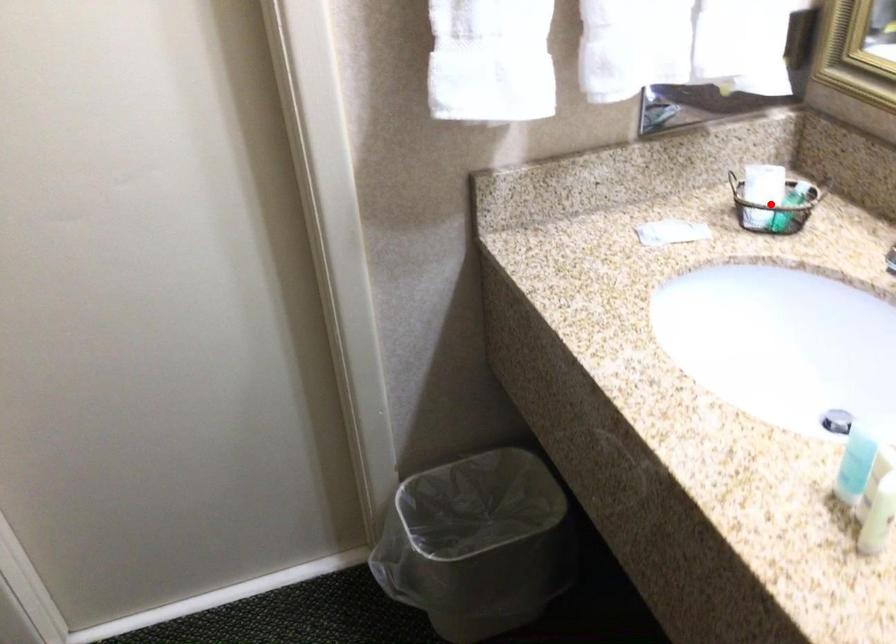
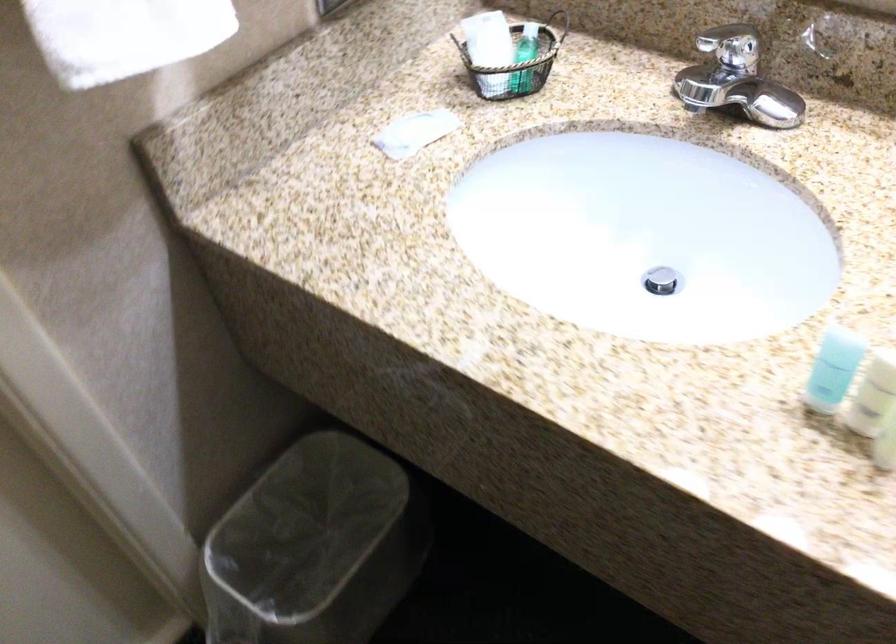
Find the pixel in the second image that matches the highlighted location in the first image.

(515, 64)